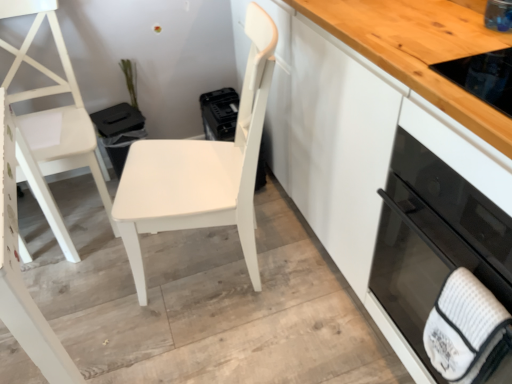
Question: Considering the relative sizes of white matte chair at left, positioned as the 1th chair in left-to-right order, and white textured hand towel at lower right in the image provided, is white matte chair at left, positioned as the 1th chair in left-to-right order, taller than white textured hand towel at lower right?

Choices:
 (A) no
 (B) yes

Answer: (B)

Question: Is white textured hand towel at lower right completely or partially inside white matte chair at left, which is the 2th chair in right-to-left order?

Choices:
 (A) no
 (B) yes

Answer: (A)

Question: From the image's perspective, is white matte chair at left, which is the 2th chair in right-to-left order, under white textured hand towel at lower right?

Choices:
 (A) yes
 (B) no

Answer: (B)

Question: Is white matte chair at left, which is the 2th chair in right-to-left order, bigger than white textured hand towel at lower right?

Choices:
 (A) no
 (B) yes

Answer: (B)

Question: Is white matte chair at center, the second chair from the left, to the left or to the right of white textured hand towel at lower right in the image?

Choices:
 (A) right
 (B) left

Answer: (B)

Question: Is white matte chair at center, the second chair from the left, in front of or behind white textured hand towel at lower right in the image?

Choices:
 (A) front
 (B) behind

Answer: (B)

Question: From the image's perspective, is white matte chair at center, the second chair from the left, positioned above or below white textured hand towel at lower right?

Choices:
 (A) below
 (B) above

Answer: (B)

Question: Which is correct: white matte chair at center, which ranks as the 1th chair in right-to-left order, is inside white textured hand towel at lower right, or outside of it?

Choices:
 (A) outside
 (B) inside

Answer: (A)

Question: Is white textured hand towel at lower right in front of or behind white matte chair at center, which ranks as the 1th chair in right-to-left order, in the image?

Choices:
 (A) behind
 (B) front

Answer: (B)

Question: Is point (444, 349) positioned closer to the camera than point (245, 142)?

Choices:
 (A) farther
 (B) closer

Answer: (B)

Question: In terms of height, does white textured hand towel at lower right look taller or shorter compared to white matte chair at center, the second chair from the left?

Choices:
 (A) short
 (B) tall

Answer: (A)

Question: From the image's perspective, is white textured hand towel at lower right located above or below white matte chair at center, which ranks as the 1th chair in right-to-left order?

Choices:
 (A) below
 (B) above

Answer: (A)

Question: Is white glossy cabinet at center wider or thinner than black glass oven at right?

Choices:
 (A) wide
 (B) thin

Answer: (A)

Question: Considering the positions of point click(487, 162) and point click(410, 288), is point click(487, 162) closer or farther from the camera than point click(410, 288)?

Choices:
 (A) closer
 (B) farther

Answer: (A)